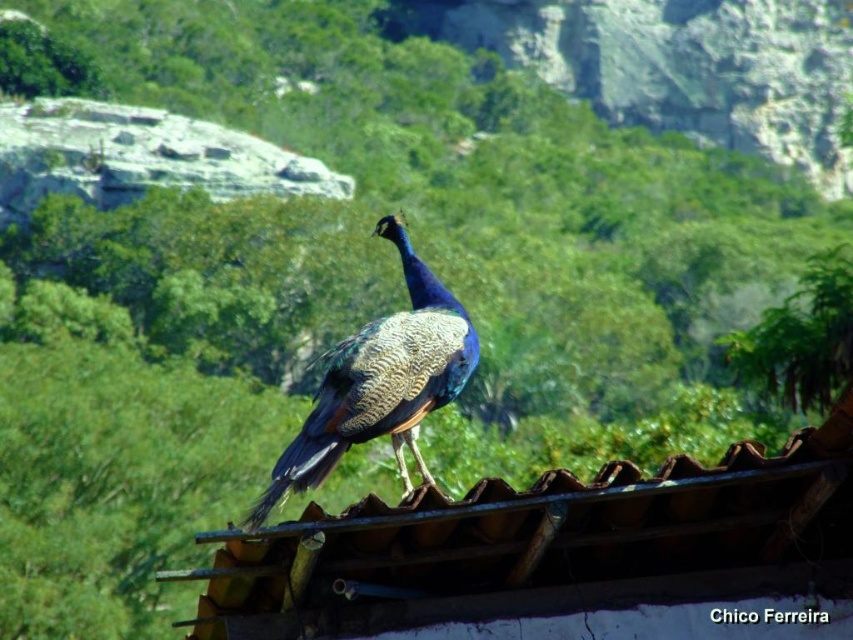
You are a birdwatcher trying to photograph the shiny blue peacock at center. The brown corrugated tile roof at center is in the way. Can you estimate if the peacock will fit in your camera frame if you zoom out slightly?

The brown corrugated tile roof at center has a larger size compared to shiny blue peacock at center. Since the roof is larger, zooming out slightly should allow the peacock to fit within the frame while including part of the roof.

You are a birdwatcher standing on the ground and want to observe the shiny blue peacock at center perched on the brown corrugated tile roof at center. If your binoculars have a minimum focus distance of 3 feet, will you be able to focus on the peacock?

The brown corrugated tile roof at center is 3.49 feet from the shiny blue peacock at center. Since your binoculars have a minimum focus distance of 3 feet, you can focus on the peacock as the distance is within the binoculars range.

From the picture: You are a birdwatcher trying to capture a photo of the shiny blue peacock at center. The brown corrugated tile roof at center is in the way. Can you estimate whether the roof is wider than the peacock?

The brown corrugated tile roof at center is wider than the shiny blue peacock at center, so yes, the roof is wider than the peacock.